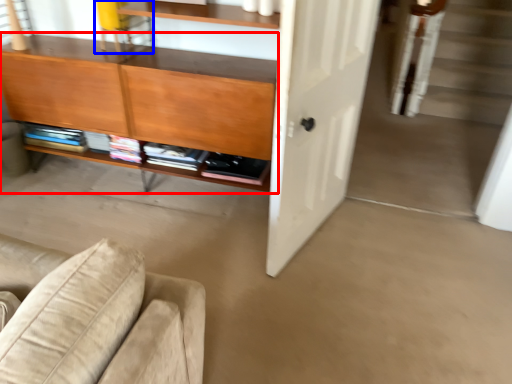
Question: Which point is closer to the camera, cabinetry (highlighted by a red box) or chair (highlighted by a blue box)?

Choices:
 (A) cabinetry
 (B) chair

Answer: (A)